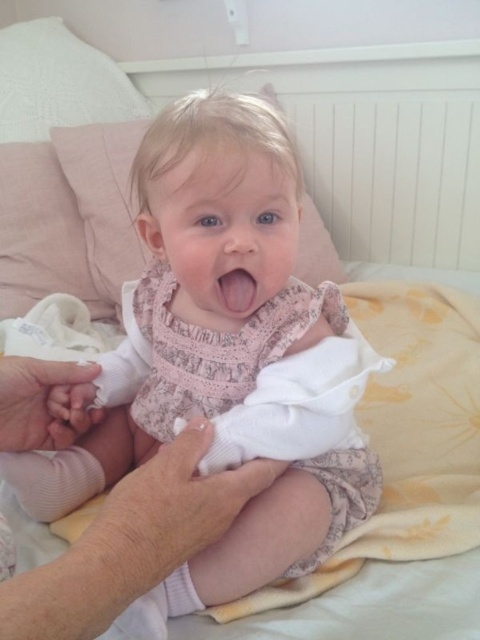
The baby in the scene is wearing a pink floral dress and has light blonde hair. You notice a white cotton diaper at center and pink glossy lips at center. Which object is taller?

The white cotton diaper at center is much taller than the pink glossy lips at center.

You are a photographer taking a picture of the baby. The pink fabric baby at center and the white cotton diaper at center are both in the frame. Which object takes up more space in the photo?

The pink fabric baby at center takes up more space in the photo because it is bigger than the white cotton diaper at center.

You are a photographer setting up for a baby photoshoot. You have a pink fabric baby at center and a white cotton diaper at center in the scene. Which object should you focus on first if you want to capture the taller object in your shot?

The pink fabric baby at center is taller than the white cotton diaper at center, so you should focus on the pink fabric baby at center first to capture the taller object.